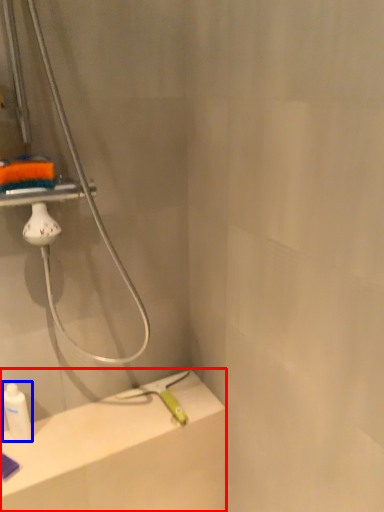
Question: Among these objects, which one is farthest to the camera, counter top (highlighted by a red box) or bottle (highlighted by a blue box)?

Choices:
 (A) counter top
 (B) bottle

Answer: (B)